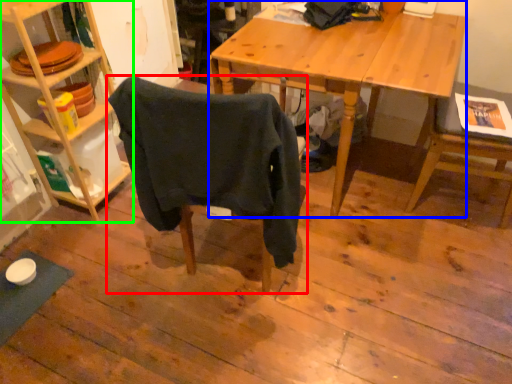
Question: Based on their relative distances, which object is nearer to chair (highlighted by a red box)? Choose from desk (highlighted by a blue box) and shelf (highlighted by a green box).

Choices:
 (A) desk
 (B) shelf

Answer: (A)